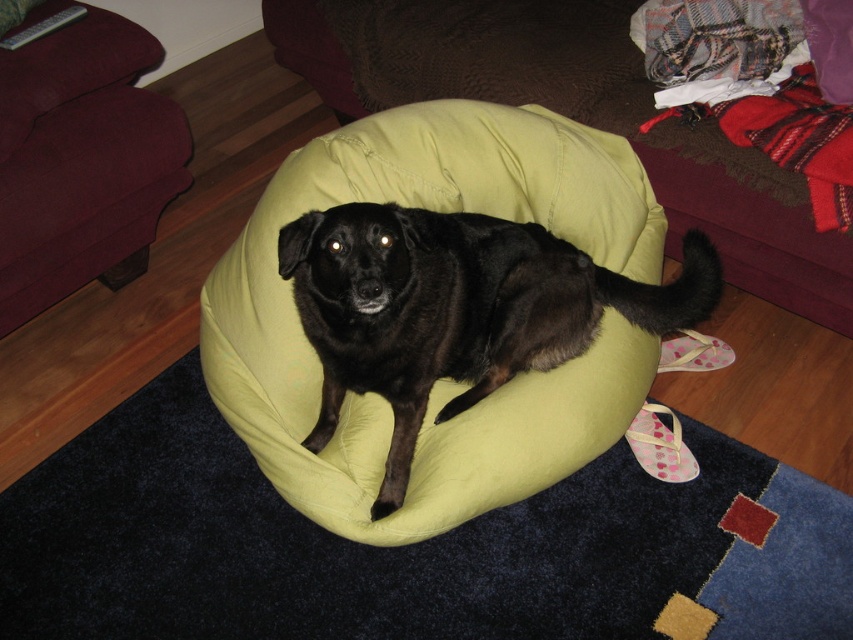
Between point (375, 371) and point (107, 106), which one is positioned behind?

The point (107, 106) is behind.

Between black matte dog at center and maroon fabric couch at upper left, which one appears on the left side from the viewer's perspective?

Positioned to the left is maroon fabric couch at upper left.

The image size is (853, 640). What are the coordinates of `black matte dog at center` in the screenshot? It's located at (456, 308).

Image resolution: width=853 pixels, height=640 pixels. What are the coordinates of `black matte dog at center` in the screenshot? It's located at (456, 308).

Between green fabric couch at center and maroon fabric couch at upper left, which one is positioned lower?

maroon fabric couch at upper left

What do you see at coordinates (575, 116) in the screenshot?
I see `green fabric couch at center` at bounding box center [575, 116].

Is point (442, 45) positioned in front of point (15, 248)?

No, it is not.

Locate an element on the screen. green fabric couch at center is located at coordinates (575, 116).

Looking at this image, who is taller, green fabric couch at center or black matte dog at center?

green fabric couch at center

What are the coordinates of `green fabric couch at center` in the screenshot? It's located at (575, 116).

The width and height of the screenshot is (853, 640). Find the location of `green fabric couch at center`. green fabric couch at center is located at coordinates (x=575, y=116).